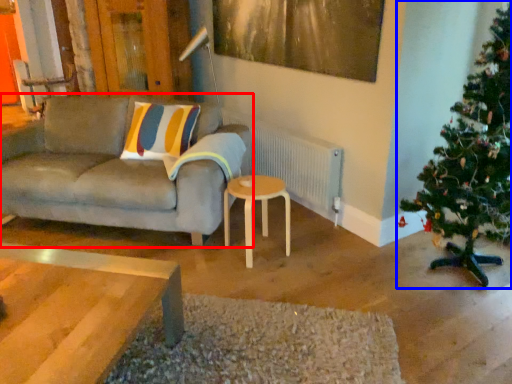
Question: Which object is closer to the camera taking this photo, studio couch (highlighted by a red box) or christmas tree (highlighted by a blue box)?

Choices:
 (A) studio couch
 (B) christmas tree

Answer: (B)